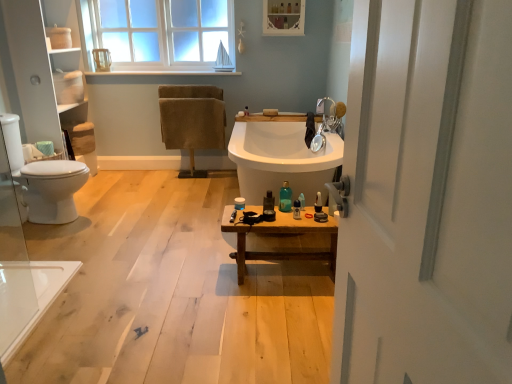
You are a GUI agent. You are given a task and a screenshot of the screen. Output one action in this format:
    pyautogui.click(x=<x>, y=<y>)
    Task: Click on the vacant area that is situated to the right of white glossy toilet at left
    This screenshot has height=384, width=512.
    Given the screenshot: What is the action you would take?
    pyautogui.click(x=118, y=215)